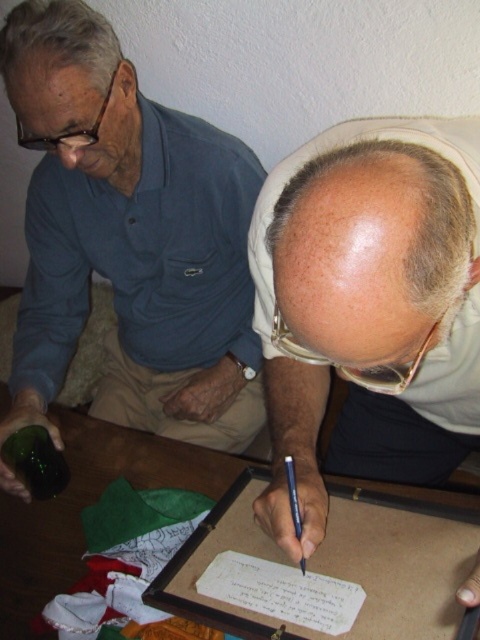
Which is in front, point (48, 61) or point (194, 484)?

Positioned in front is point (48, 61).

Where is `matte blue shirt at left`? This screenshot has width=480, height=640. matte blue shirt at left is located at coordinates (129, 237).

How much distance is there between matte blue shirt at left and green matte bottle at lower left?

14.70 inches

Is the position of matte blue shirt at left less distant than that of green matte bottle at lower left?

That is True.

Between point (207, 356) and point (24, 436), which one is positioned in front?

Point (24, 436)

Identify the location of matte blue shirt at left. The height and width of the screenshot is (640, 480). (129, 237).

Is smooth beige head at center above green matte bottle at lower left?

Correct, smooth beige head at center is located above green matte bottle at lower left.

Who is more distant from viewer, [332,141] or [48,435]?

Point [48,435]

Is point (442, 282) in front of point (27, 435)?

Yes, it is in front of point (27, 435).

Identify the location of smooth beige head at center. This screenshot has height=640, width=480. (367, 292).